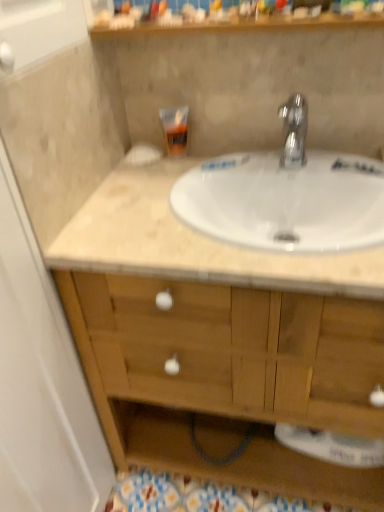
What is the approximate width of wooden shelf at upper center?

The width of wooden shelf at upper center is 8.78 inches.

The height and width of the screenshot is (512, 384). What do you see at coordinates (175, 129) in the screenshot? I see `translucent plastic tube at upper center` at bounding box center [175, 129].

Image resolution: width=384 pixels, height=512 pixels. Find the location of `translucent plastic tube at upper center`. translucent plastic tube at upper center is located at coordinates (175, 129).

Locate an element on the screen. The image size is (384, 512). polished chrome faucet at upper center is located at coordinates (294, 131).

The height and width of the screenshot is (512, 384). I want to click on white marble sink at center, so click(x=193, y=242).

Where is `wooden shelf at upper center`? This screenshot has width=384, height=512. wooden shelf at upper center is located at coordinates (241, 18).

Is translucent plastic tube at upper center facing towards white marble sink at center?

No, translucent plastic tube at upper center is not turned towards white marble sink at center.

Does translucent plastic tube at upper center have a larger size compared to white marble sink at center?

Incorrect, translucent plastic tube at upper center is not larger than white marble sink at center.

Measure the distance from translucent plastic tube at upper center to white marble sink at center.

The distance of translucent plastic tube at upper center from white marble sink at center is 12.53 inches.

Considering the sizes of objects translucent plastic tube at upper center and white marble sink at center in the image provided, who is wider, translucent plastic tube at upper center or white marble sink at center?

white marble sink at center is wider.

Is wooden cabinet at center looking in the opposite direction of wooden shelf at upper center?

No, wooden cabinet at center's orientation is not away from wooden shelf at upper center.

Considering the sizes of objects wooden cabinet at center and wooden shelf at upper center in the image provided, who is wider, wooden cabinet at center or wooden shelf at upper center?

Wider between the two is wooden cabinet at center.

Is wooden cabinet at center in front of wooden shelf at upper center?

Yes, it is.

Is white marble sink at center situated inside translucent plastic tube at upper center or outside?

white marble sink at center is outside translucent plastic tube at upper center.

Is point (355, 278) more distant than point (174, 140)?

That is False.

Between white marble sink at center and translucent plastic tube at upper center, which one is positioned behind?

translucent plastic tube at upper center is further from the camera.

Is white marble sink at center positioned far away from translucent plastic tube at upper center?

No, white marble sink at center is not far from translucent plastic tube at upper center.

Is translucent plastic tube at upper center looking in the opposite direction of polished chrome faucet at upper center?

No.

What's the angular difference between translucent plastic tube at upper center and polished chrome faucet at upper center's facing directions?

13.4 degrees separate the facing orientations of translucent plastic tube at upper center and polished chrome faucet at upper center.

Is translucent plastic tube at upper center inside or outside of polished chrome faucet at upper center?

translucent plastic tube at upper center is not inside polished chrome faucet at upper center, it's outside.

In order to click on tap located above the translucent plastic tube at upper center (from a real-world perspective) in this screenshot , I will do `click(294, 131)`.

From the image's perspective, is wooden cabinet at center located above or below white marble sink at center?

From the image's perspective, wooden cabinet at center appears below white marble sink at center.

From the picture: From a real-world perspective, is wooden cabinet at center below white marble sink at center?

Yes, from a real-world perspective, wooden cabinet at center is under white marble sink at center.

Relative to white marble sink at center, is wooden cabinet at center in front or behind?

wooden cabinet at center is positioned closer to the viewer than white marble sink at center.

Is wooden cabinet at center thinner than white marble sink at center?

In fact, wooden cabinet at center might be wider than white marble sink at center.

Considering the sizes of objects white marble sink at center and wooden cabinet at center in the image provided, who is shorter, white marble sink at center or wooden cabinet at center?

Standing shorter between the two is white marble sink at center.

From the picture: Is white marble sink at center positioned with its back to wooden cabinet at center?

Absolutely, white marble sink at center is directed away from wooden cabinet at center.

Considering their positions, is white marble sink at center located in front of or behind wooden cabinet at center?

white marble sink at center is positioned farther from the viewer than wooden cabinet at center.

Are white marble sink at center and wooden cabinet at center located far from each other?

That's not correct — white marble sink at center is a little close to wooden cabinet at center.

Measure the distance between polished chrome faucet at upper center and wooden cabinet at center.

A distance of 20.10 inches exists between polished chrome faucet at upper center and wooden cabinet at center.

Which is farther from the camera, [300,152] or [114,387]?

The point [114,387] is behind.

Is polished chrome faucet at upper center not within wooden cabinet at center?

Yes, polished chrome faucet at upper center is outside of wooden cabinet at center.

Identify the location of toiletry lying above the white marble sink at center (from the image's perspective). Image resolution: width=384 pixels, height=512 pixels. (175, 129).

There is a wooden cabinet at center. Where is `shelf above it (from a real-world perspective)`? This screenshot has height=512, width=384. shelf above it (from a real-world perspective) is located at coordinates (241, 18).

Estimate the real-world distances between objects in this image. Which object is further from white marble sink at center, wooden cabinet at center or polished chrome faucet at upper center?

Among the two, polished chrome faucet at upper center is located further to white marble sink at center.

Estimate the real-world distances between objects in this image. Which object is closer to wooden cabinet at center, white marble sink at center or translucent plastic tube at upper center?

Among the two, white marble sink at center is located nearer to wooden cabinet at center.

When comparing their distances from wooden shelf at upper center, does translucent plastic tube at upper center or white marble sink at center seem closer?

translucent plastic tube at upper center.

Considering their positions, is wooden shelf at upper center positioned closer to white marble sink at center than wooden cabinet at center?

wooden cabinet at center is positioned closer to the anchor white marble sink at center.

Based on their spatial positions, is white marble sink at center or translucent plastic tube at upper center closer to wooden shelf at upper center?

Among the two, translucent plastic tube at upper center is located nearer to wooden shelf at upper center.

When comparing their distances from polished chrome faucet at upper center, does wooden cabinet at center or white marble sink at center seem closer?

white marble sink at center lies closer to polished chrome faucet at upper center than the other object.

Considering their positions, is wooden cabinet at center positioned closer to wooden shelf at upper center than polished chrome faucet at upper center?

polished chrome faucet at upper center is closer to wooden shelf at upper center.

From the image, which object appears to be nearer to wooden cabinet at center, white marble sink at center or polished chrome faucet at upper center?

white marble sink at center lies closer to wooden cabinet at center than the other object.

At what (x,y) coordinates should I click in order to perform the action: click on countertop between translucent plastic tube at upper center and wooden cabinet at center from top to bottom. Please return your answer as a coordinate pair (x, y). Looking at the image, I should click on [x=193, y=242].

Where is `countertop between polished chrome faucet at upper center and wooden cabinet at center in the up-down direction`? The height and width of the screenshot is (512, 384). countertop between polished chrome faucet at upper center and wooden cabinet at center in the up-down direction is located at coordinates (193, 242).

Locate an element on the screen. This screenshot has width=384, height=512. tap between wooden shelf at upper center and white marble sink at center from top to bottom is located at coordinates (294, 131).

I want to click on tap between translucent plastic tube at upper center and wooden cabinet at center in the vertical direction, so click(294, 131).